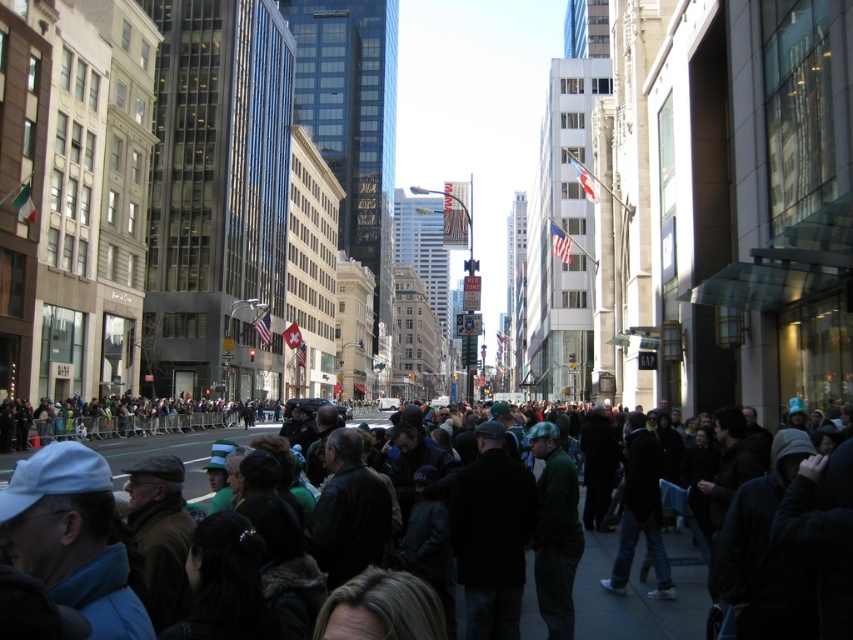
Does dark clothing crowd at center have a lesser width compared to dark green fabric crowd at lower left?

Incorrect, dark clothing crowd at center's width is not less than dark green fabric crowd at lower left's.

In the scene shown: Is dark clothing crowd at center to the right of dark green fabric crowd at lower left from the viewer's perspective?

Correct, you'll find dark clothing crowd at center to the right of dark green fabric crowd at lower left.

The height and width of the screenshot is (640, 853). I want to click on dark clothing crowd at center, so click(x=640, y=593).

You are a GUI agent. You are given a task and a screenshot of the screen. Output one action in this format:
    pyautogui.click(x=<x>, y=<y>)
    Task: Click on the dark clothing crowd at center
    
    Given the screenshot: What is the action you would take?
    pyautogui.click(x=640, y=593)